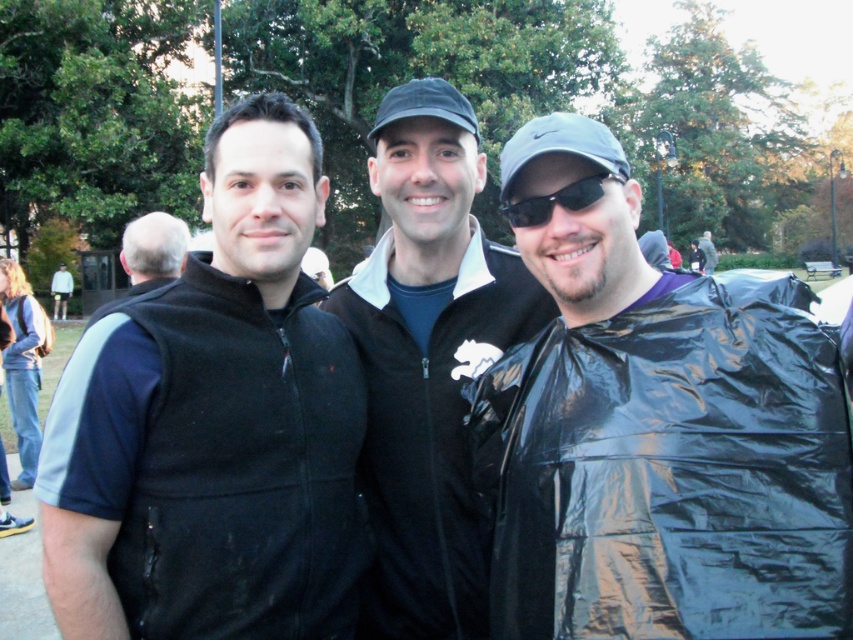
Question: Is glossy plastic bag at right bigger than gray hair at left?

Choices:
 (A) yes
 (B) no

Answer: (B)

Question: Which of the following is the farthest from the observer?

Choices:
 (A) (456, 250)
 (B) (140, 276)
 (C) (596, 173)

Answer: (B)

Question: Can you confirm if black matte jacket at center is smaller than light gray hoodie at upper left?

Choices:
 (A) no
 (B) yes

Answer: (B)

Question: Can you confirm if glossy plastic bag at right is positioned above black fleece vest at center?

Choices:
 (A) yes
 (B) no

Answer: (B)

Question: Which of the following is the farthest from the observer?

Choices:
 (A) (88, 566)
 (B) (482, 552)

Answer: (B)

Question: Which is nearer to the black matte jacket at center?

Choices:
 (A) black fleece vest at center
 (B) black plastic goggles at center

Answer: (B)